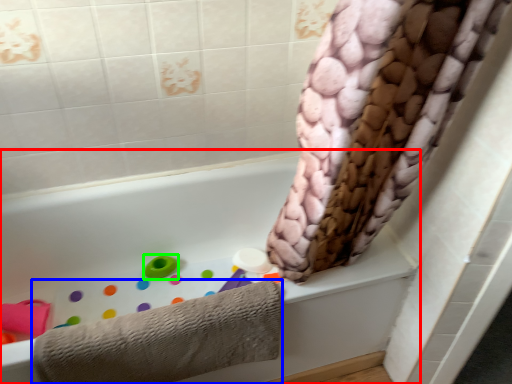
Question: Which object is the farthest from bathtub (highlighted by a red box)? Choose among these: towel (highlighted by a blue box) or toy (highlighted by a green box).

Choices:
 (A) towel
 (B) toy

Answer: (A)